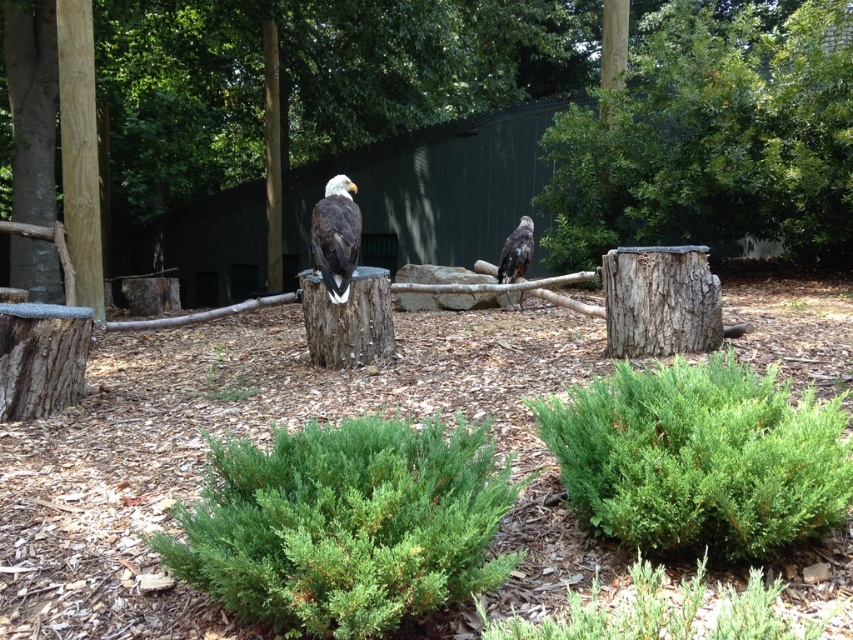
You are a visitor at the sanctuary and want to take a photo of the green leafy bush at upper right and the brown rough wood pole at left. Which object should you focus on first to ensure both are in the frame?

You should focus on the green leafy bush at upper right first because it is closer to you than the brown rough wood pole at left, so adjusting the camera to include both would require starting with the closer object.

You are standing at the center of the scene and want to find the green leafy bush at upper right. Based on the coordinates provided, which direction should you look to locate it?

The green leafy bush at upper right is located at coordinates point (711,138), so you should look towards the upper right direction to find it.